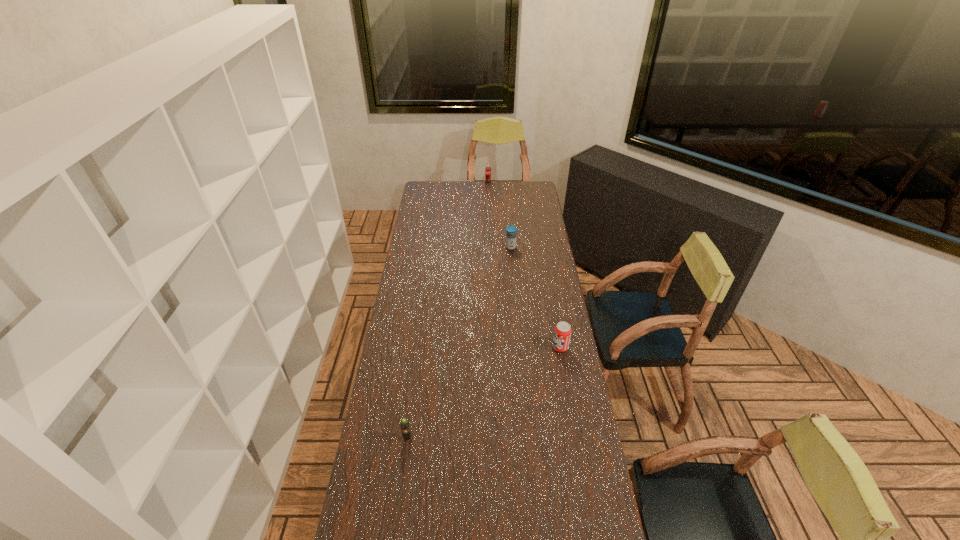
Where is `the farthest object`? The height and width of the screenshot is (540, 960). the farthest object is located at coordinates (488, 170).

Locate an element on the screen. the second soda from right to left is located at coordinates (488, 170).

Locate an element on the screen. the second nearest soda is located at coordinates (562, 333).

In order to click on the rightmost soda in this screenshot , I will do `click(562, 333)`.

The height and width of the screenshot is (540, 960). Find the location of `the third object from left to right`. the third object from left to right is located at coordinates (511, 236).

I want to click on medicine, so click(511, 236).

Image resolution: width=960 pixels, height=540 pixels. In order to click on the leftmost object in this screenshot , I will do `click(405, 428)`.

Identify the location of the nearest object. The height and width of the screenshot is (540, 960). (405, 428).

This screenshot has height=540, width=960. I want to click on vacant space located 0.320m on the label of the second object from left to right, so click(x=489, y=212).

Locate an element on the screen. The height and width of the screenshot is (540, 960). vacant region located on the surface of the second nearest soda is located at coordinates (506, 347).